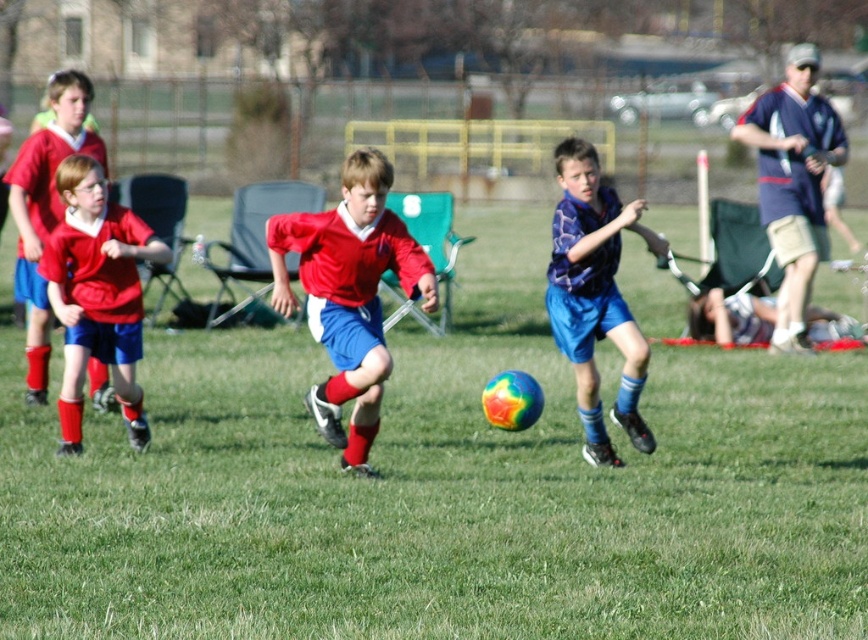
Question: Which of the following is the closest to the observer?

Choices:
 (A) matte red shirt at center
 (B) blue fabric cap at upper right
 (C) smooth green grass at center
 (D) plaid shirt at center

Answer: (C)

Question: Can you confirm if matte red shirt at center is positioned to the left of blue fabric cap at upper right?

Choices:
 (A) no
 (B) yes

Answer: (B)

Question: Observing the image, what is the correct spatial positioning of matte red shirt at center in reference to blue fabric cap at upper right?

Choices:
 (A) right
 (B) left

Answer: (B)

Question: Based on their relative distances, which object is nearer to the matte red shirt at center?

Choices:
 (A) blue fabric cap at upper right
 (B) plaid shirt at center
 (C) smooth green grass at center

Answer: (B)

Question: Does smooth green grass at center come in front of blue fabric cap at upper right?

Choices:
 (A) yes
 (B) no

Answer: (A)

Question: Among these objects, which one is farthest from the camera?

Choices:
 (A) matte red shirt at center
 (B) smooth green grass at center
 (C) plaid shirt at center

Answer: (C)